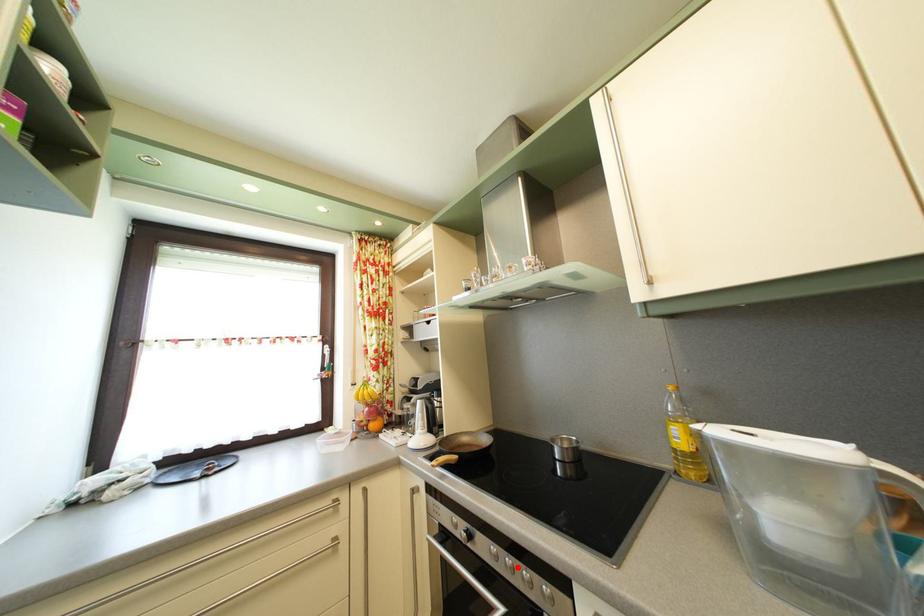
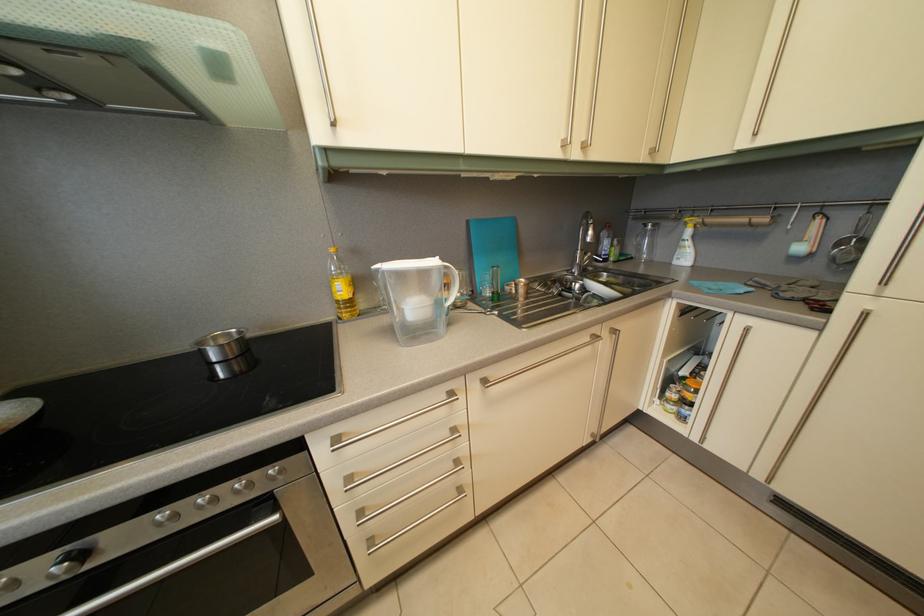
In the second image, find the point that corresponds to the highlighted location in the first image.

(211, 505)